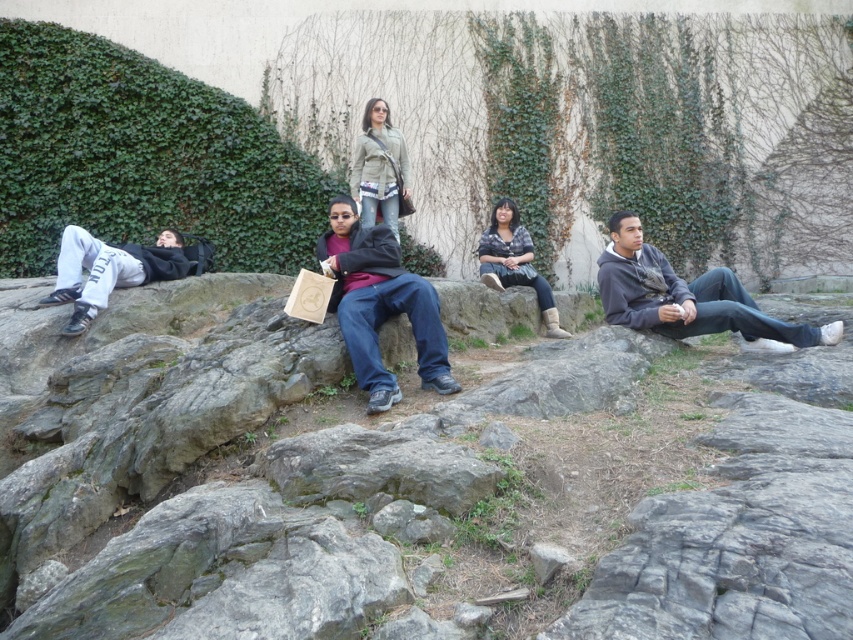
Question: Considering the relative positions of green leafy ivy at upper left and matte green jacket at center in the image provided, where is green leafy ivy at upper left located with respect to matte green jacket at center?

Choices:
 (A) above
 (B) below

Answer: (A)

Question: Can you confirm if matte black jacket at center is wider than matte green jacket at center?

Choices:
 (A) yes
 (B) no

Answer: (A)

Question: Which object appears closest to the camera in this image?

Choices:
 (A) dark gray hoodie at right
 (B) white cotton pants at left

Answer: (A)

Question: Considering the real-world distances, which object is closest to the green leafy ivy at upper left?

Choices:
 (A) matte green jacket at center
 (B) dark gray hoodie at right
 (C) matte black jacket at center

Answer: (A)

Question: Considering the real-world distances, which object is closest to the matte green jacket at center?

Choices:
 (A) matte black jacket at center
 (B) gray rock at center
 (C) green leafy ivy at upper left
 (D) plaid shirt at center

Answer: (D)

Question: Can you confirm if matte black jacket at center is positioned above plaid shirt at center?

Choices:
 (A) no
 (B) yes

Answer: (A)